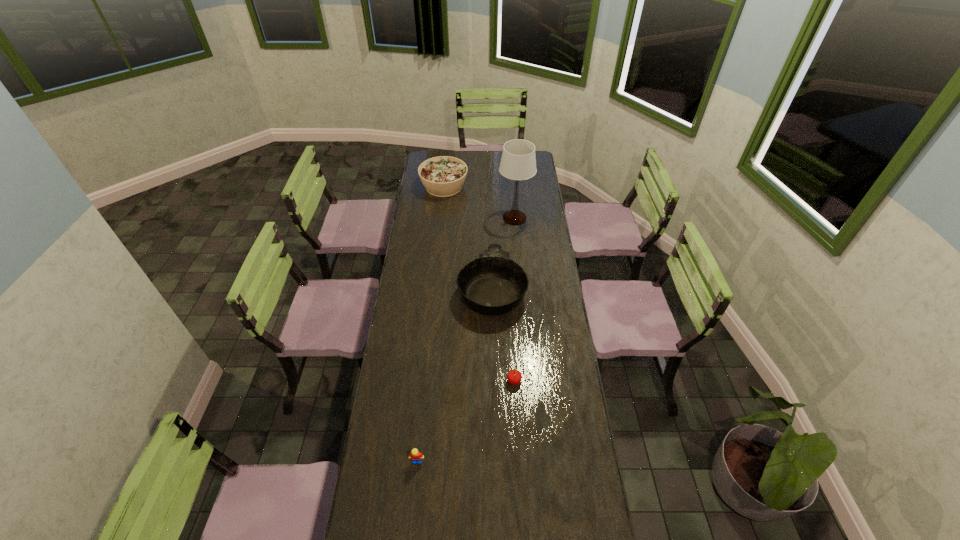
Where is `the second farthest object`? the second farthest object is located at coordinates (518, 162).

Identify the location of table lamp. (518, 162).

Find the location of `salad`. salad is located at coordinates (443, 176).

Find the location of a particular element. The height and width of the screenshot is (540, 960). the second tallest object is located at coordinates (443, 176).

I want to click on the third farthest object, so point(493,284).

Find the location of a particular element. This screenshot has height=540, width=960. the second nearest object is located at coordinates (x=514, y=377).

Identify the location of Lego. The width and height of the screenshot is (960, 540). (416, 457).

Find the location of a particular element. the shortest object is located at coordinates (416, 457).

You are a GUI agent. You are given a task and a screenshot of the screen. Output one action in this format:
    pyautogui.click(x=<x>, y=<y>)
    Task: Click on the vacant space located 0.380m above the cylindrical shade of the fourth nearest object
    
    Given the screenshot: What is the action you would take?
    pyautogui.click(x=520, y=281)

Identify the location of free location located 0.280m on the right of the salad. The width and height of the screenshot is (960, 540). (516, 187).